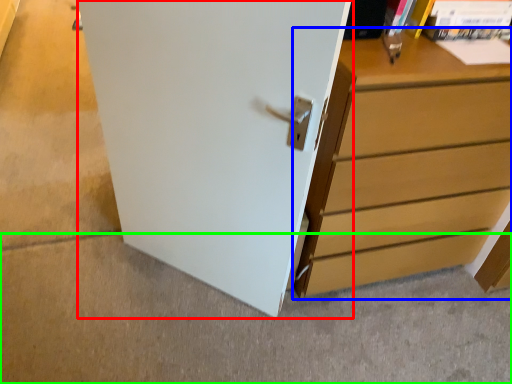
Question: Which is farther away from door (highlighted by a red box)? chest of drawers (highlighted by a blue box) or concrete (highlighted by a green box)?

Choices:
 (A) chest of drawers
 (B) concrete

Answer: (B)